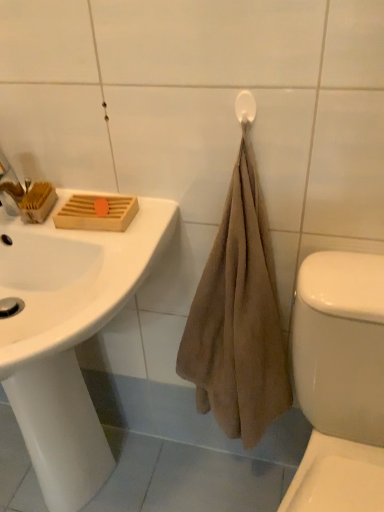
Describe the element at coordinates (340, 382) in the screenshot. This screenshot has width=384, height=512. I see `white glossy toilet at lower right` at that location.

At what (x,y) coordinates should I click in order to perform the action: click on white glossy toilet at lower right. Please return your answer as a coordinate pair (x, y). This screenshot has width=384, height=512. Looking at the image, I should click on (340, 382).

Is white plastic towel bar at upper right positioned behind white glossy sink at upper left?

Yes, it is behind white glossy sink at upper left.

In terms of height, does white plastic towel bar at upper right look taller or shorter compared to white glossy sink at upper left?

Considering their sizes, white plastic towel bar at upper right has less height than white glossy sink at upper left.

Which is less distant, (x=244, y=116) or (x=341, y=339)?

Positioned in front is point (x=244, y=116).

Consider the image. Is white plastic towel bar at upper right facing away from white glossy toilet at lower right?

That's not correct — white plastic towel bar at upper right is not looking away from white glossy toilet at lower right.

Considering the positions of objects white plastic towel bar at upper right and white glossy toilet at lower right in the image provided, who is more to the left, white plastic towel bar at upper right or white glossy toilet at lower right?

white plastic towel bar at upper right.

From a real-world perspective, between white plastic towel bar at upper right and white glossy toilet at lower right, who is vertically lower?

In real-world perspective, white glossy toilet at lower right is lower.

Considering the relative sizes of white glossy sink at upper left and white glossy toilet at lower right in the image provided, is white glossy sink at upper left wider than white glossy toilet at lower right?

Indeed, white glossy sink at upper left has a greater width compared to white glossy toilet at lower right.

You are a GUI agent. You are given a task and a screenshot of the screen. Output one action in this format:
    pyautogui.click(x=<x>, y=<y>)
    Task: Click on the sink that is above the white glossy toilet at lower right (from a real-world perspective)
    The height and width of the screenshot is (512, 384).
    Given the screenshot: What is the action you would take?
    pyautogui.click(x=68, y=337)

Considering the positions of objects white glossy sink at upper left and white glossy toilet at lower right in the image provided, who is more to the left, white glossy sink at upper left or white glossy toilet at lower right?

white glossy sink at upper left.

From their relative heights in the image, would you say white glossy toilet at lower right is taller or shorter than white plastic towel bar at upper right?

Considering their sizes, white glossy toilet at lower right has more height than white plastic towel bar at upper right.

Consider the image. In terms of width, does white glossy toilet at lower right look wider or thinner when compared to white plastic towel bar at upper right?

Considering their sizes, white glossy toilet at lower right looks broader than white plastic towel bar at upper right.

Which is farther from the camera, (367, 406) or (242, 95)?

Point (367, 406)

From the image's perspective, is white glossy sink at upper left located above or below white plastic towel bar at upper right?

From the image's perspective, white glossy sink at upper left appears below white plastic towel bar at upper right.

Does white glossy sink at upper left appear on the left side of white plastic towel bar at upper right?

Yes, white glossy sink at upper left is to the left of white plastic towel bar at upper right.

Which object is further away from the camera, white glossy sink at upper left or white plastic towel bar at upper right?

white plastic towel bar at upper right is more distant.

From the picture: Does white glossy sink at upper left touch white plastic towel bar at upper right?

No, white glossy sink at upper left is not making contact with white plastic towel bar at upper right.

Does white glossy toilet at lower right have a lesser height compared to white glossy sink at upper left?

No.

From the image's perspective, is white glossy toilet at lower right under white glossy sink at upper left?

Yes, from the image's perspective, white glossy toilet at lower right is below white glossy sink at upper left.

The height and width of the screenshot is (512, 384). Find the location of `sink behind the white glossy toilet at lower right`. sink behind the white glossy toilet at lower right is located at coordinates (68, 337).

In terms of width, does white glossy toilet at lower right look wider or thinner when compared to white glossy sink at upper left?

white glossy toilet at lower right is thinner than white glossy sink at upper left.

Identify the location of sink below the white plastic towel bar at upper right (from a real-world perspective). (68, 337).

Identify the location of toilet below the white plastic towel bar at upper right (from the image's perspective). Image resolution: width=384 pixels, height=512 pixels. (x=340, y=382).

From the image, which object appears to be farther from white glossy toilet at lower right, white glossy sink at upper left or white plastic towel bar at upper right?

The object further to white glossy toilet at lower right is white plastic towel bar at upper right.

Based on their spatial positions, is white glossy sink at upper left or white glossy toilet at lower right further from white plastic towel bar at upper right?

Among the two, white glossy sink at upper left is located further to white plastic towel bar at upper right.

Considering their positions, is white plastic towel bar at upper right positioned further to white glossy toilet at lower right than white glossy sink at upper left?

white plastic towel bar at upper right is further to white glossy toilet at lower right.

From the image, which object appears to be nearer to white glossy sink at upper left, white glossy toilet at lower right or white plastic towel bar at upper right?

white glossy toilet at lower right lies closer to white glossy sink at upper left than the other object.

Based on their spatial positions, is white plastic towel bar at upper right or white glossy toilet at lower right further from white glossy sink at upper left?

white plastic towel bar at upper right is positioned further to the anchor white glossy sink at upper left.

Looking at the image, which one is located closer to white plastic towel bar at upper right, white glossy toilet at lower right or white glossy sink at upper left?

The object closer to white plastic towel bar at upper right is white glossy toilet at lower right.

You are a GUI agent. You are given a task and a screenshot of the screen. Output one action in this format:
    pyautogui.click(x=<x>, y=<y>)
    Task: Click on the sink between white plastic towel bar at upper right and white glossy toilet at lower right vertically
    This screenshot has height=512, width=384.
    Given the screenshot: What is the action you would take?
    pyautogui.click(x=68, y=337)